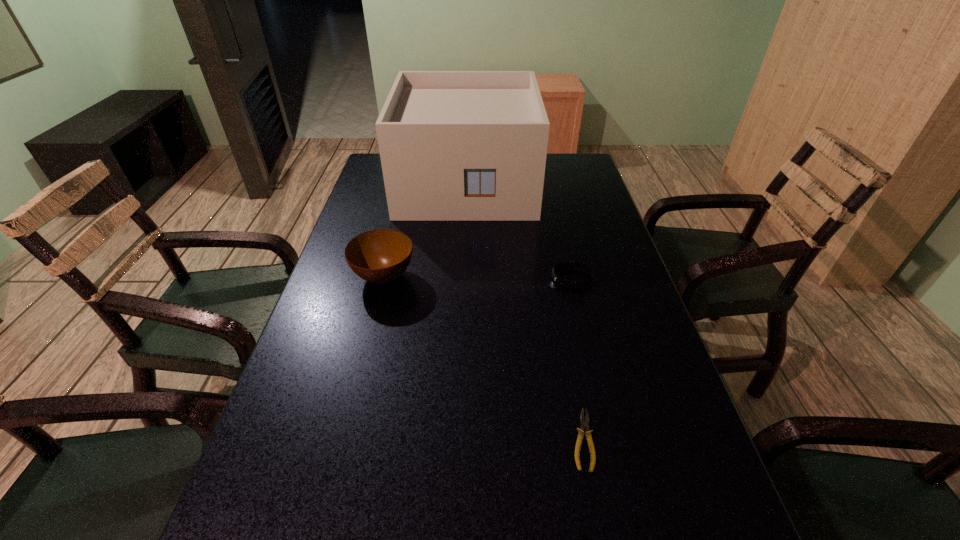
Locate an element on the screen. The height and width of the screenshot is (540, 960). vacant region located 0.250m on the display of the third tallest object is located at coordinates (453, 278).

In order to click on blank area located 0.090m on the left of the nearest object in this screenshot , I will do `click(520, 440)`.

You are a GUI agent. You are given a task and a screenshot of the screen. Output one action in this format:
    pyautogui.click(x=<x>, y=<y>)
    Task: Click on the object that is at the far edge
    Image resolution: width=960 pixels, height=540 pixels.
    Given the screenshot: What is the action you would take?
    pyautogui.click(x=454, y=145)

Locate an element on the screen. This screenshot has height=540, width=960. box that is positioned at the left edge is located at coordinates (454, 145).

Image resolution: width=960 pixels, height=540 pixels. Identify the location of bowl at the left edge. (380, 256).

Find the location of a particular element. object that is at the right edge is located at coordinates click(562, 282).

Find the location of a particular element. object that is at the far left corner is located at coordinates click(454, 145).

This screenshot has width=960, height=540. I want to click on free location at the left edge, so click(x=316, y=322).

Where is `vacant space at the right edge`? This screenshot has width=960, height=540. vacant space at the right edge is located at coordinates (670, 423).

Where is `free space between the second shortest object and the bowl`? Image resolution: width=960 pixels, height=540 pixels. free space between the second shortest object and the bowl is located at coordinates (478, 277).